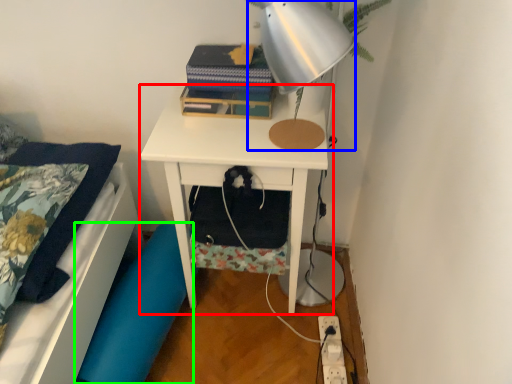
Question: Which object is the farthest from nightstand (highlighted by a red box)? Choose among these: lamp (highlighted by a blue box) or swivel chair (highlighted by a green box).

Choices:
 (A) lamp
 (B) swivel chair

Answer: (A)